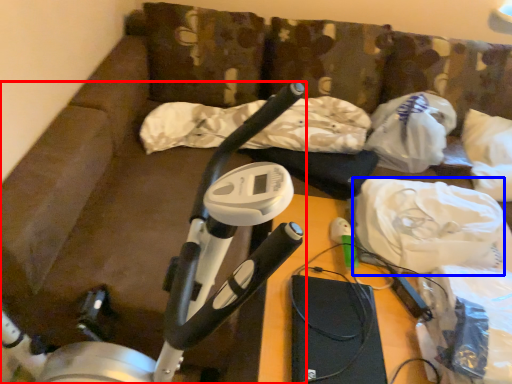
Question: Among these objects, which one is farthest to the camera, stationary bicycle (highlighted by a red box) or material (highlighted by a blue box)?

Choices:
 (A) stationary bicycle
 (B) material

Answer: (B)